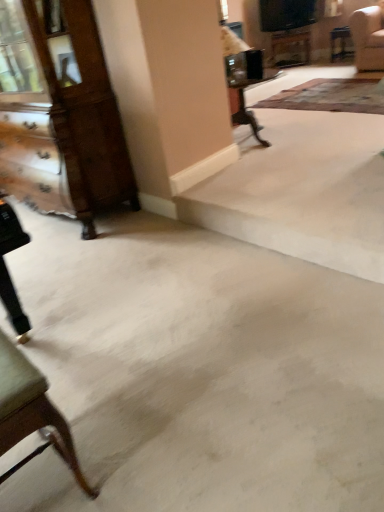
Question: Does patterned carpet at upper right appear on the left side of wooden table at upper center?

Choices:
 (A) yes
 (B) no

Answer: (B)

Question: Does patterned carpet at upper right appear on the right side of wooden table at upper center?

Choices:
 (A) no
 (B) yes

Answer: (B)

Question: Does patterned carpet at upper right have a greater height compared to wooden table at upper center?

Choices:
 (A) no
 (B) yes

Answer: (A)

Question: Can you confirm if patterned carpet at upper right is thinner than wooden table at upper center?

Choices:
 (A) no
 (B) yes

Answer: (A)

Question: Is patterned carpet at upper right closer to camera compared to wooden table at upper center?

Choices:
 (A) yes
 (B) no

Answer: (A)

Question: Is wooden dresser at left to the left or to the right of wooden table at upper center in the image?

Choices:
 (A) right
 (B) left

Answer: (B)

Question: In terms of size, does wooden dresser at left appear bigger or smaller than wooden table at upper center?

Choices:
 (A) big
 (B) small

Answer: (A)

Question: Is wooden dresser at left inside the boundaries of wooden table at upper center, or outside?

Choices:
 (A) outside
 (B) inside

Answer: (A)

Question: In terms of height, does wooden dresser at left look taller or shorter compared to wooden table at upper center?

Choices:
 (A) short
 (B) tall

Answer: (B)

Question: Do you think wooden table at upper center is within wooden dresser at left, or outside of it?

Choices:
 (A) outside
 (B) inside

Answer: (A)

Question: From the image's perspective, is wooden table at upper center above or below wooden dresser at left?

Choices:
 (A) below
 (B) above

Answer: (B)

Question: Based on their positions, is wooden table at upper center located to the left or right of wooden dresser at left?

Choices:
 (A) left
 (B) right

Answer: (B)

Question: Considering the positions of point (273, 45) and point (31, 54), is point (273, 45) closer or farther from the camera than point (31, 54)?

Choices:
 (A) closer
 (B) farther

Answer: (B)

Question: In the image, is wooden table at upper center on the left side or the right side of patterned carpet at upper right?

Choices:
 (A) left
 (B) right

Answer: (A)

Question: From a real-world perspective, is wooden table at upper center positioned above or below patterned carpet at upper right?

Choices:
 (A) above
 (B) below

Answer: (A)